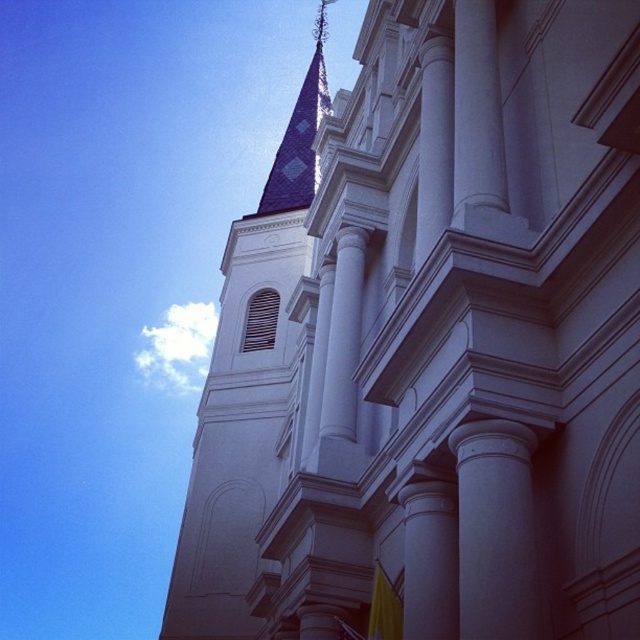
Consider the image. Can you confirm if white stone steeple at upper center is bigger than smooth white column at center?

Indeed, white stone steeple at upper center has a larger size compared to smooth white column at center.

Is point (288, 400) less distant than point (524, 448)?

No, (288, 400) is behind (524, 448).

This screenshot has height=640, width=640. I want to click on white stone steeple at upper center, so click(x=246, y=387).